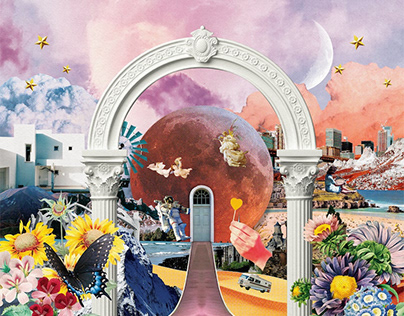
At what (x,y) coordinates should I click in order to perform the action: click on globe. Please return your answer as a coordinate pair (x, y). The image size is (404, 316). Looking at the image, I should click on point(206,125).